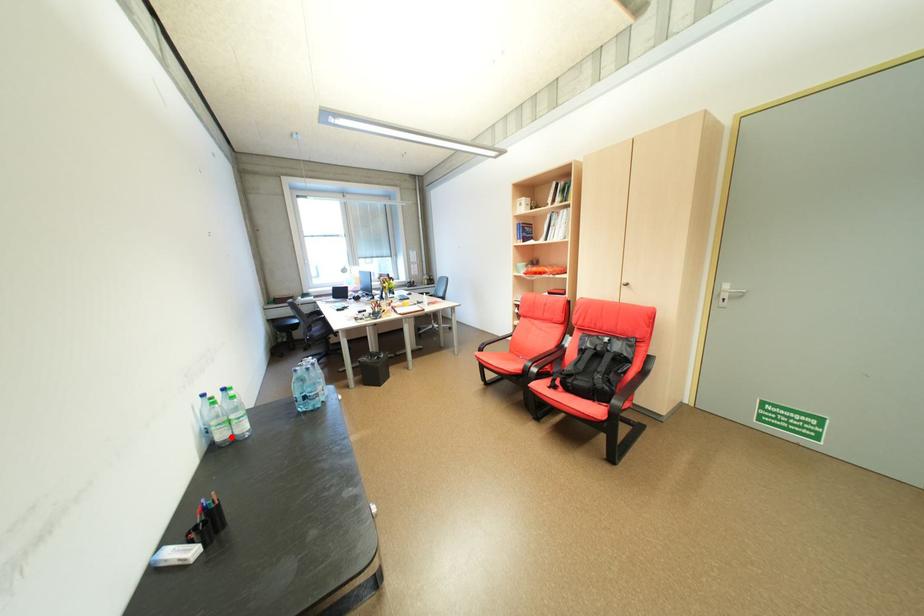
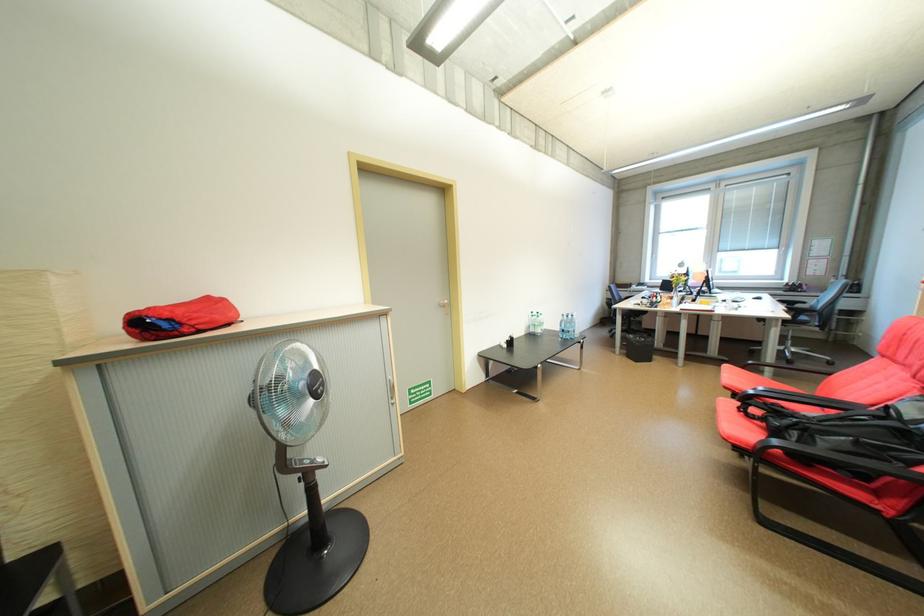
Locate, in the second image, the point that corresponds to the highlighted location in the first image.

(541, 331)